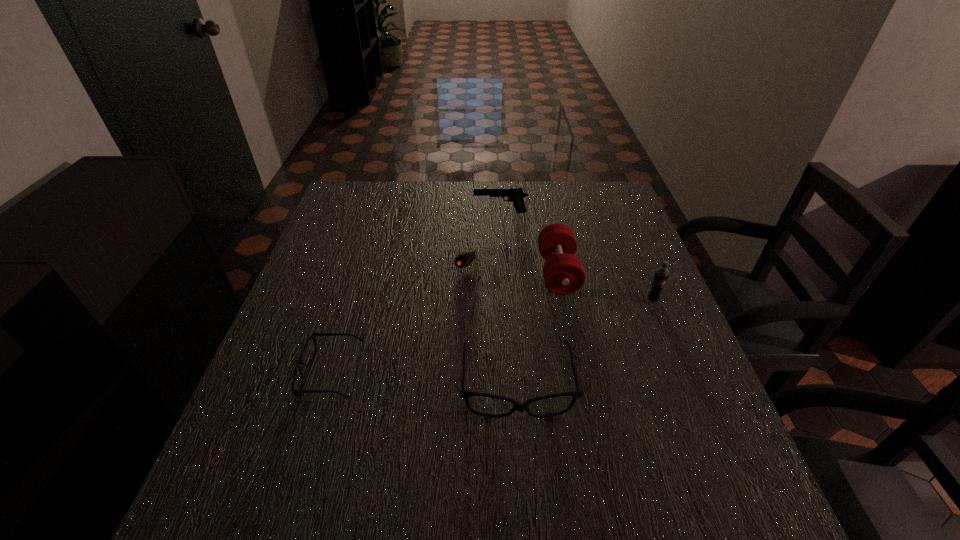
The image size is (960, 540). I want to click on vacant area that lies between the dumbbell and the rightmost object, so click(606, 286).

Where is `unoccupied area between the leftmost object and the shortest object`? This screenshot has height=540, width=960. unoccupied area between the leftmost object and the shortest object is located at coordinates (398, 316).

Where is `unoccupied position between the fourth tallest object and the gun`? The width and height of the screenshot is (960, 540). unoccupied position between the fourth tallest object and the gun is located at coordinates (509, 299).

In order to click on vacant space that is in between the second shortest object and the fourth tallest object in this screenshot , I will do `click(423, 379)`.

At what (x,y) coordinates should I click in order to perform the action: click on blank region between the tallest object and the third shortest object. Please return your answer as a coordinate pair (x, y). Image resolution: width=960 pixels, height=540 pixels. Looking at the image, I should click on (585, 342).

Locate an element on the screen. The height and width of the screenshot is (540, 960). object that stands as the third closest to the taller spectacles is located at coordinates (661, 275).

Where is `object that stands as the fifth closest to the computer mouse`? object that stands as the fifth closest to the computer mouse is located at coordinates (661, 275).

You are a GUI agent. You are given a task and a screenshot of the screen. Output one action in this format:
    pyautogui.click(x=<x>, y=<y>)
    Task: Click on the free location that satisfies the following two spatial constraints: 1. at the aiming end of the dumbbell; 2. on the right side of the gun
    This screenshot has width=960, height=540.
    Given the screenshot: What is the action you would take?
    pos(504,273)

Locate an element on the screen. This screenshot has width=960, height=540. blank space that satisfies the following two spatial constraints: 1. on the front label of the soda; 2. on the front-facing side of the left spectacles is located at coordinates (684, 374).

What are the coordinates of `vacant space that satisfies the following two spatial constraints: 1. on the front label of the soda; 2. on the front-facing side of the shorter spectacles` in the screenshot? It's located at (684, 374).